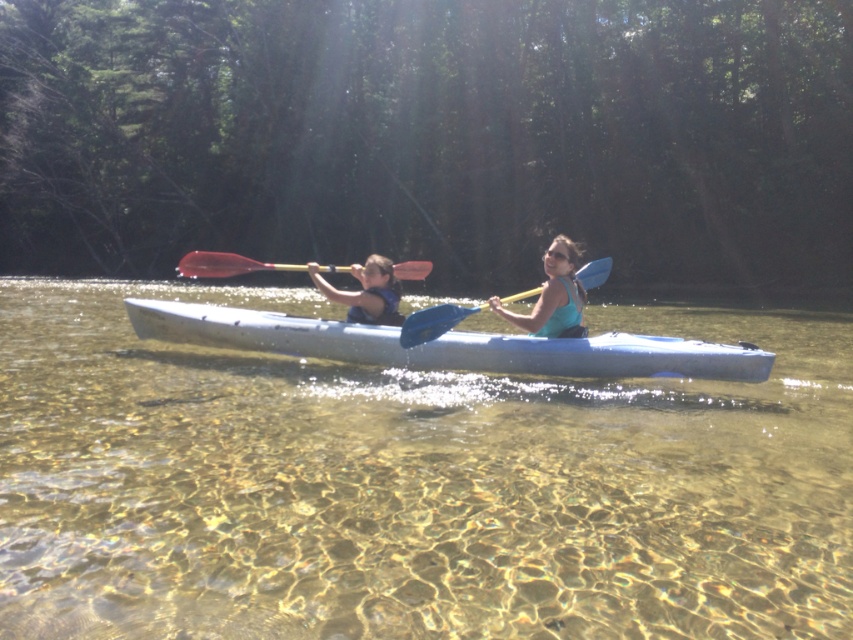
Is matte blue kayak at center bigger than red plastic paddle at center?

No.

The image size is (853, 640). Identify the location of matte blue kayak at center. (553, 296).

Between point (297, 397) and point (229, 259), which one is positioned in front?

Point (297, 397) is more forward.

Does clear water at center appear on the right side of red plastic paddle at center?

Yes, clear water at center is to the right of red plastic paddle at center.

What are the coordinates of `clear water at center` in the screenshot? It's located at (412, 484).

Which is below, white plastic canoe at center or matte blue kayak at center?

Positioned lower is white plastic canoe at center.

Is point (260, 349) positioned before point (560, 241)?

That is False.

Is point (538, 353) in front of point (560, 266)?

No, (538, 353) is behind (560, 266).

Identify the location of white plastic canoe at center. This screenshot has width=853, height=640. (447, 346).